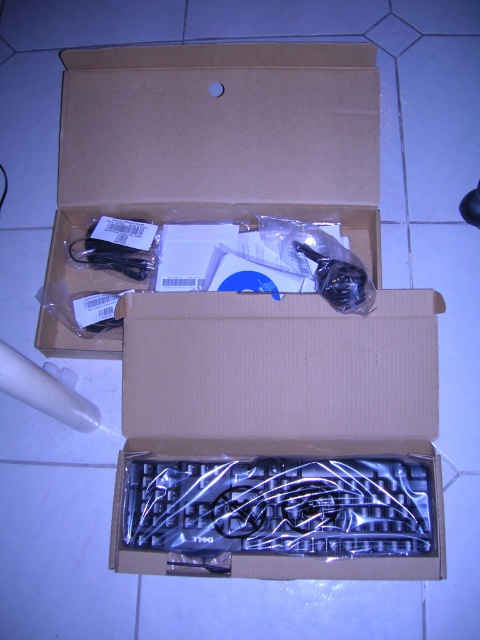
You are standing at the point marked as point (440, 536). You want to pick up the Dell keyboard from the box. Can you reach it without moving your position?

The point (440, 536) is 31.45 inches away from the viewer. Since the Dell keyboard is inside the box, which is on the tiled floor, the distance might be too far to reach comfortably. However, without specific information about arm length or box dimensions, it is uncertain. The answer cannot be definitively determined with the given data.

You are organizing items in a box. You have to place a new item at the position marked by point (x=278, y=436). What item is already occupying that position?

The clear plastic keyboard at center is already occupying the position marked by point (x=278, y=436).

You are packing items into a brown cardboard box at upper center and want to place a clear plastic keyboard at center inside it. Can the keyboard fit inside the box based on their sizes?

The clear plastic keyboard at center has a lesser width compared to brown cardboard box at upper center, so it can fit inside the box.